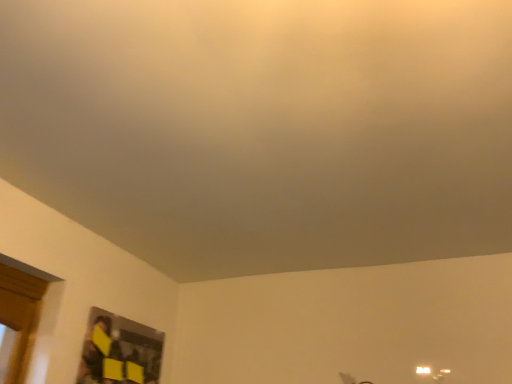
What do you see at coordinates (119, 351) in the screenshot? Image resolution: width=512 pixels, height=384 pixels. I see `matte yellow picture frame at lower left` at bounding box center [119, 351].

Locate an element on the screen. This screenshot has height=384, width=512. matte yellow picture frame at lower left is located at coordinates (119, 351).

Locate an element on the screen. The height and width of the screenshot is (384, 512). matte yellow picture frame at lower left is located at coordinates (119, 351).